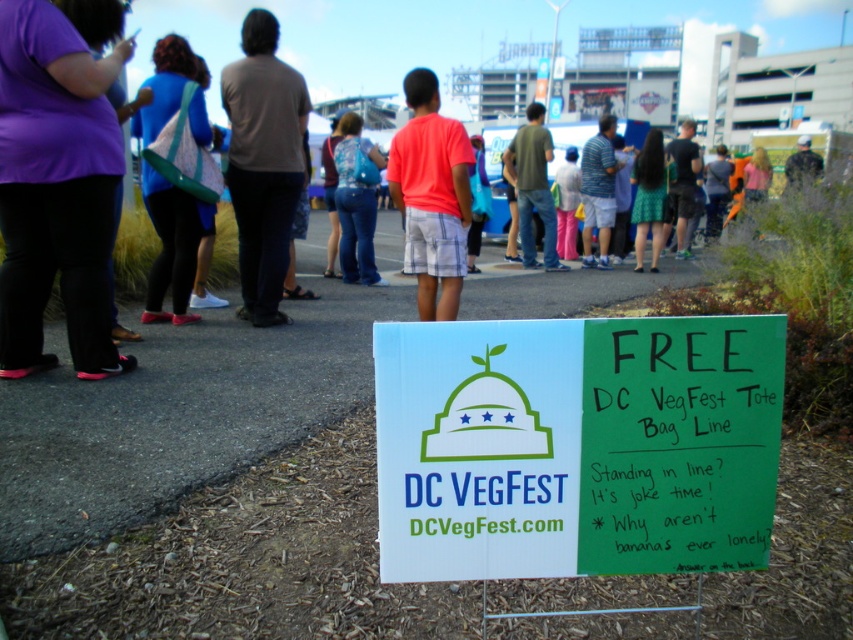
You are at DC VegFest and see the purple fabric at left and the blue fabric bag at upper left. Which fabric is positioned more to the left?

The blue fabric bag at upper left is positioned more to the left than the purple fabric at left.